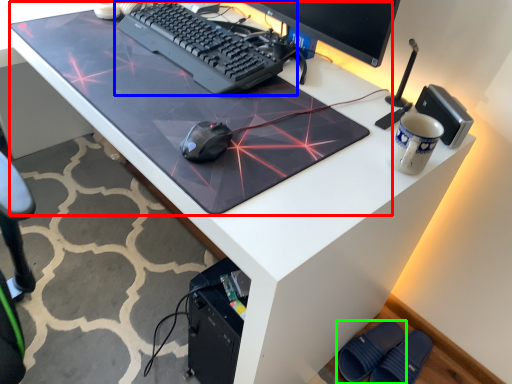
Question: Which object is positioned closest to table top (highlighted by a red box)? Select from computer keyboard (highlighted by a blue box) and footwear (highlighted by a green box).

Choices:
 (A) computer keyboard
 (B) footwear

Answer: (A)